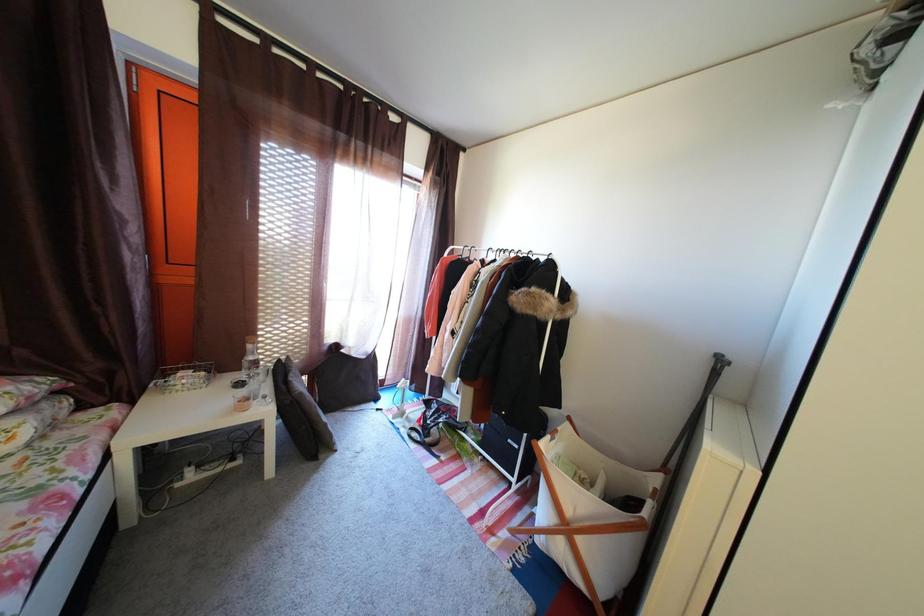
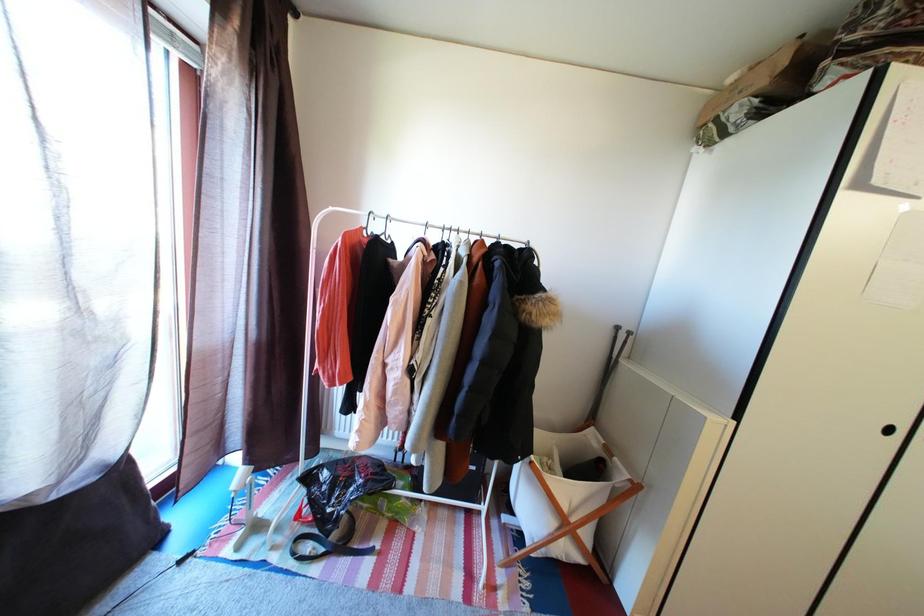
Question: The camera is either moving clockwise (left) or counter-clockwise (right) around the object. The first image is from the beginning of the video and the second image is from the end. Is the camera moving left or right when shooting the video?

Choices:
 (A) Left
 (B) Right

Answer: (A)